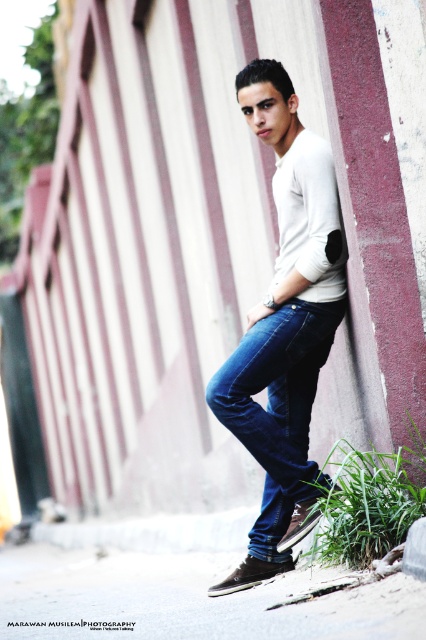
Question: Is matte white sweater at center positioned before dark blue denim jeans at lower center?

Choices:
 (A) yes
 (B) no

Answer: (A)

Question: Which point appears closest to the camera in this image?

Choices:
 (A) (311, 388)
 (B) (241, 440)

Answer: (B)

Question: Is matte white sweater at center positioned behind dark blue denim jeans at lower center?

Choices:
 (A) no
 (B) yes

Answer: (A)

Question: Which of the following is the closest to the observer?

Choices:
 (A) dark blue denim jeans at lower center
 (B) matte white sweater at center

Answer: (B)

Question: Which point appears closest to the camera in this image?

Choices:
 (A) (236, 372)
 (B) (258, 552)

Answer: (A)

Question: Where is matte white sweater at center located in relation to dark blue denim jeans at lower center in the image?

Choices:
 (A) right
 (B) left

Answer: (A)